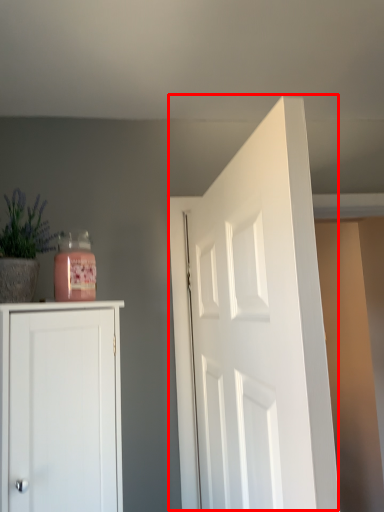
Question: From the image's perspective, considering the relative positions of door (annotated by the red box) and plant in the image provided, where is door (annotated by the red box) located with respect to the staircase?

Choices:
 (A) above
 (B) below

Answer: (B)